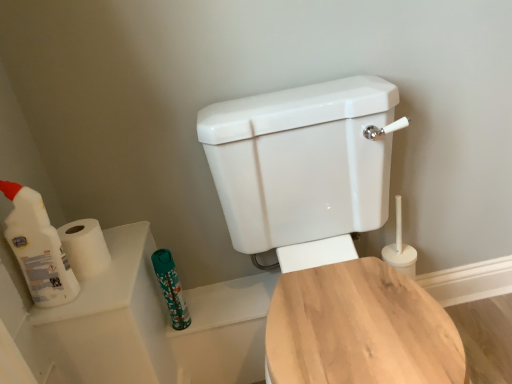
Where is `free space to the back side of teal fabric toiletry at lower center`? The height and width of the screenshot is (384, 512). free space to the back side of teal fabric toiletry at lower center is located at coordinates (201, 296).